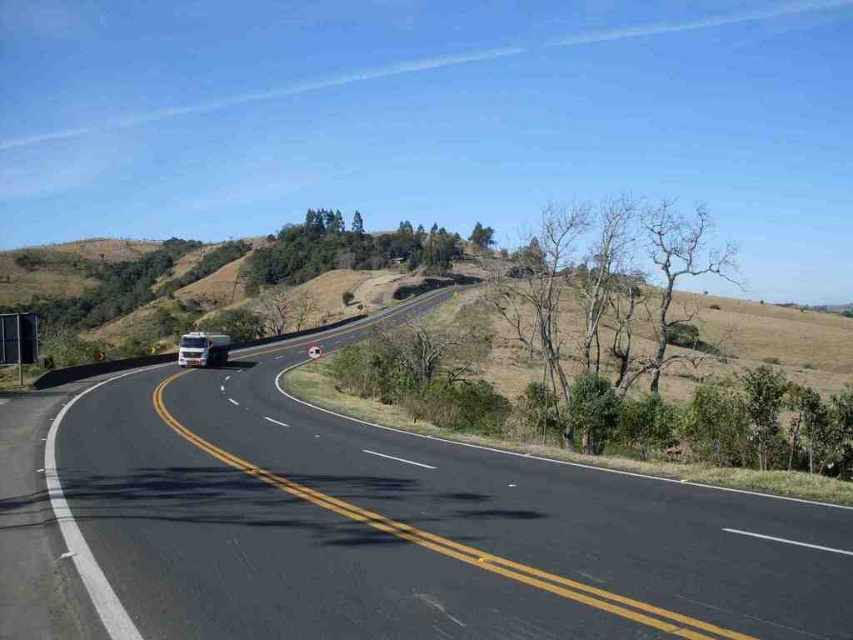
Is black asphalt highway at center shorter than white glossy truck at center?

Yes, black asphalt highway at center is shorter than white glossy truck at center.

Does black asphalt highway at center have a greater width compared to white glossy truck at center?

Yes.

Find the location of a particular element. This screenshot has width=853, height=640. black asphalt highway at center is located at coordinates (405, 529).